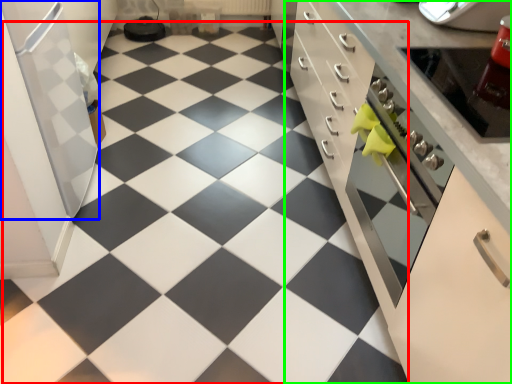
Question: Which object is the closest to the tile (highlighted by a red box)? Choose among these: appliance (highlighted by a blue box) or cabinetry (highlighted by a green box).

Choices:
 (A) appliance
 (B) cabinetry

Answer: (A)